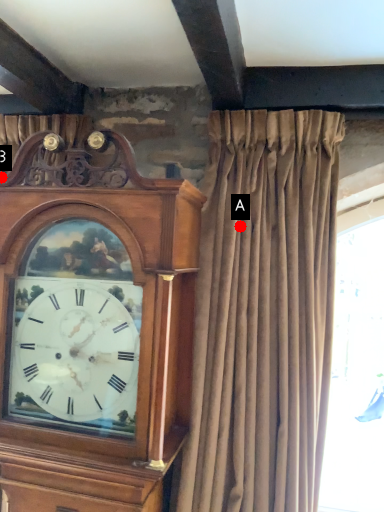
Question: Two points are circled on the image, labeled by A and B beside each circle. Which point is closer to the camera?

Choices:
 (A) A is closer
 (B) B is closer

Answer: (B)